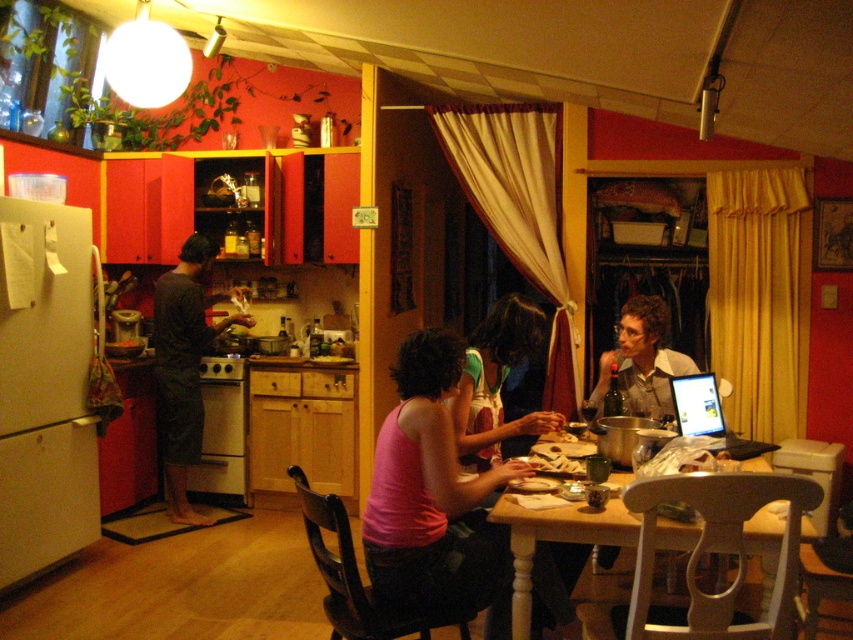
Consider the image. You are a delivery robot with a package that needs to be placed on the light brown wooden table at center. You are currently positioned next to the dark gray fabric at left. The robot has a maximum reach of 2.5 meters. Can you reach the table without moving closer?

The dark gray fabric at left and light brown wooden table at center are 2.69 meters apart from each other. Since the robot can only reach 2.5 meters, it cannot place the package on the table without moving closer.

You are a guest in this kitchen and want to place your phone on the light brown wooden table at center without it sliding off. Considering the pink fabric tank top at lower center is already on the table, where should you place your phone?

The pink fabric tank top at lower center is taller than the light brown wooden table at center, so placing the phone on the table next to the tank top might cause it to slide off. Instead, place the phone on the table away from the tank top where there is more stable space.

You are standing in the kitchen and see the pink fabric tank top at lower center. If you want to place a small object exactly at the coordinate point mentioned in the description, where should you place it relative to the tank top?

The pink fabric tank top at lower center is already positioned at the coordinate point mentioned in the description, so you should place the small object exactly where the pink fabric tank top at lower center is located.